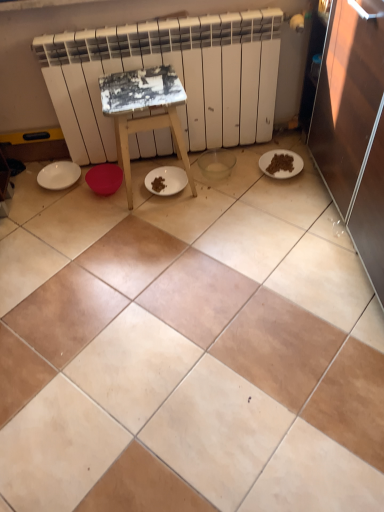
The image size is (384, 512). I want to click on vacant space in between white painted wood stool at center and white matte plate at lower right, the 1th paper plate when ordered from right to left, so click(x=228, y=176).